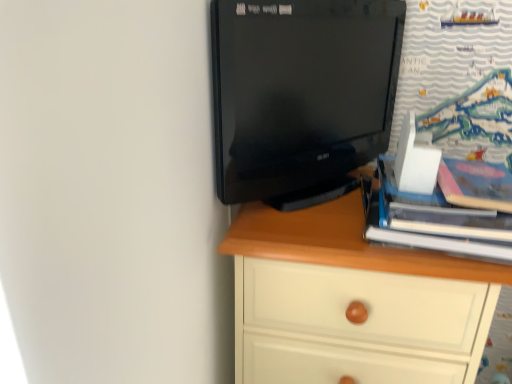
The image size is (512, 384). Identify the location of black glossy monitor at upper center. (300, 90).

What is the approximate width of white wood chest of drawers at center?

white wood chest of drawers at center is 16.28 inches wide.

I want to click on black glossy monitor at upper center, so click(x=300, y=90).

Which of these two, hardcover book at right or black glossy monitor at upper center, is bigger?

With larger size is black glossy monitor at upper center.

Which of these two, hardcover book at right or black glossy monitor at upper center, is thinner?

black glossy monitor at upper center is thinner.

In terms of height, does hardcover book at right look taller or shorter compared to black glossy monitor at upper center?

Considering their sizes, hardcover book at right has less height than black glossy monitor at upper center.

From the image's perspective, is hardcover book at right on black glossy monitor at upper center?

No, from the image's perspective, hardcover book at right is not on top of black glossy monitor at upper center.

Where is `computer monitor lying above the hardcover book at right (from the image's perspective)`? The width and height of the screenshot is (512, 384). computer monitor lying above the hardcover book at right (from the image's perspective) is located at coordinates click(300, 90).

Can you confirm if black glossy monitor at upper center is thinner than hardcover book at right?

Correct, the width of black glossy monitor at upper center is less than that of hardcover book at right.

Which of these two, black glossy monitor at upper center or hardcover book at right, is smaller?

Smaller between the two is hardcover book at right.

How many degrees apart are the facing directions of black glossy monitor at upper center and hardcover book at right?

A: 56.6 degrees separate the facing orientations of black glossy monitor at upper center and hardcover book at right.

Based on the photo, could you tell me if hardcover book at right is facing white wood chest of drawers at center?

No, hardcover book at right is not aimed at white wood chest of drawers at center.

Is hardcover book at right smaller than white wood chest of drawers at center?

Correct, hardcover book at right occupies less space than white wood chest of drawers at center.

Is point (466, 233) positioned after point (346, 236)?

No, (466, 233) is closer to viewer.

Consider the image. From a real-world perspective, does white wood chest of drawers at center sit lower than hardcover book at right?

Yes.

Does white wood chest of drawers at center have a greater width compared to hardcover book at right?

Yes, white wood chest of drawers at center is wider than hardcover book at right.

From the image's perspective, which is above, white wood chest of drawers at center or hardcover book at right?

hardcover book at right appears higher in the image.

Consider the image. Is white wood chest of drawers at center taller than hardcover book at right?

Correct, white wood chest of drawers at center is much taller as hardcover book at right.

From the image's perspective, is white wood chest of drawers at center above or below black glossy monitor at upper center?

white wood chest of drawers at center is below black glossy monitor at upper center.

Can you confirm if white wood chest of drawers at center is wider than black glossy monitor at upper center?

Yes, white wood chest of drawers at center is wider than black glossy monitor at upper center.

The image size is (512, 384). In order to click on computer monitor located on the left of white wood chest of drawers at center in this screenshot , I will do `click(300, 90)`.

What's the angular difference between white wood chest of drawers at center and black glossy monitor at upper center's facing directions?

The angle between the facing direction of white wood chest of drawers at center and the facing direction of black glossy monitor at upper center is 51.4 degrees.

Does black glossy monitor at upper center have a smaller size compared to white wood chest of drawers at center?

Yes.

Would you say black glossy monitor at upper center is to the left or to the right of white wood chest of drawers at center in the picture?

Based on their positions, black glossy monitor at upper center is located to the left of white wood chest of drawers at center.

Is black glossy monitor at upper center inside the boundaries of white wood chest of drawers at center, or outside?

black glossy monitor at upper center is spatially situated outside white wood chest of drawers at center.

Is black glossy monitor at upper center facing away from white wood chest of drawers at center?

That's not correct — black glossy monitor at upper center is not looking away from white wood chest of drawers at center.

Identify the location of book that appears on the right of black glossy monitor at upper center. This screenshot has height=384, width=512. (437, 222).

What are the coordinates of `computer monitor in front of the hardcover book at right` in the screenshot? It's located at (300, 90).

Based on the photo, from the image, which object appears to be nearer to white wood chest of drawers at center, black glossy monitor at upper center or hardcover book at right?

Among the two, hardcover book at right is located nearer to white wood chest of drawers at center.

Looking at the image, which one is located further to white wood chest of drawers at center, hardcover book at right or black glossy monitor at upper center?

black glossy monitor at upper center lies further to white wood chest of drawers at center than the other object.

Based on their spatial positions, is black glossy monitor at upper center or white wood chest of drawers at center further from hardcover book at right?

black glossy monitor at upper center.

Based on their spatial positions, is white wood chest of drawers at center or black glossy monitor at upper center closer to hardcover book at right?

white wood chest of drawers at center is closer to hardcover book at right.

When comparing their distances from black glossy monitor at upper center, does white wood chest of drawers at center or hardcover book at right seem closer?

white wood chest of drawers at center is positioned closer to the anchor black glossy monitor at upper center.

Estimate the real-world distances between objects in this image. Which object is closer to black glossy monitor at upper center, hardcover book at right or white wood chest of drawers at center?

white wood chest of drawers at center is positioned closer to the anchor black glossy monitor at upper center.

Identify the location of book between black glossy monitor at upper center and white wood chest of drawers at center in the up-down direction. (437, 222).